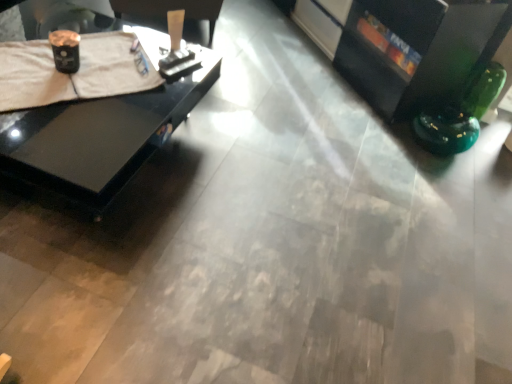
Where is `free space in front of white cloth at upper left`? The width and height of the screenshot is (512, 384). free space in front of white cloth at upper left is located at coordinates coord(90,127).